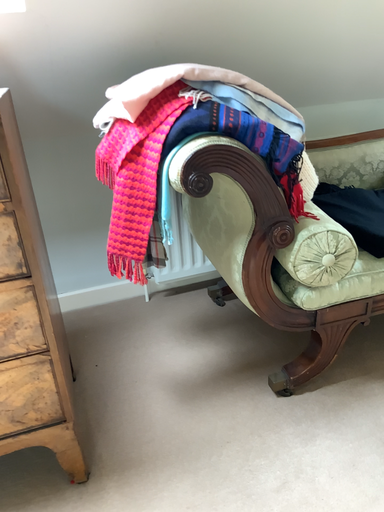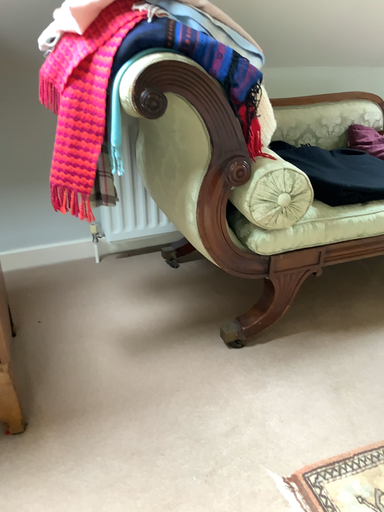
Question: How did the camera likely rotate when shooting the video?

Choices:
 (A) rotated right
 (B) rotated left

Answer: (A)